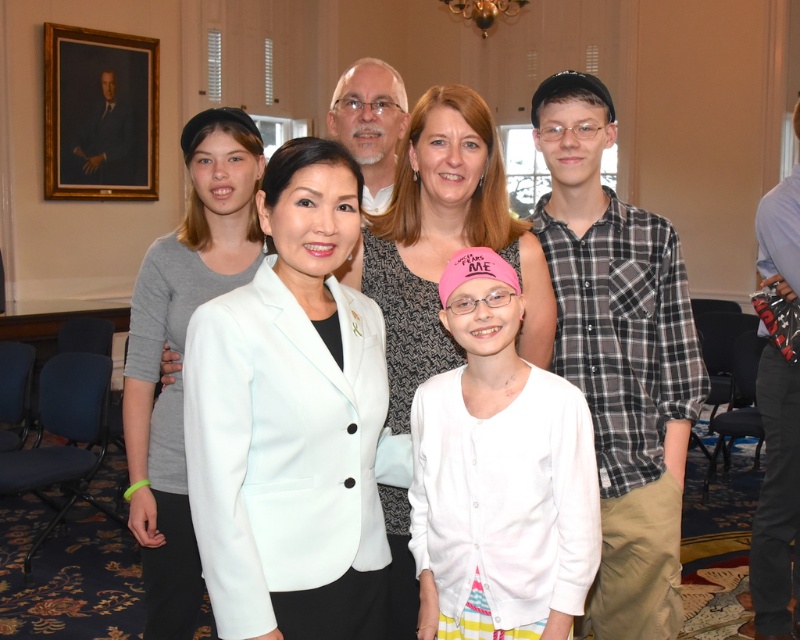
Question: Which point is closer to the camera?

Choices:
 (A) (218, 113)
 (B) (449, 419)
 (C) (394, 564)

Answer: (B)

Question: Which object is farther from the camera taking this photo?

Choices:
 (A) pink fabric cap at center
 (B) plaid flannel shirt at right

Answer: (B)

Question: Does plaid flannel shirt at right have a smaller size compared to white textured shirt at center?

Choices:
 (A) yes
 (B) no

Answer: (B)

Question: Which of the following is the closest to the observer?

Choices:
 (A) light blue shirt at center
 (B) light blue fabric jacket at center
 (C) pink fabric cap at center
 (D) white matte blazer at center

Answer: (D)

Question: Does light blue fabric jacket at center appear under white textured shirt at center?

Choices:
 (A) no
 (B) yes

Answer: (B)

Question: Does white matte blazer at center have a smaller size compared to pink fabric cap at center?

Choices:
 (A) no
 (B) yes

Answer: (A)